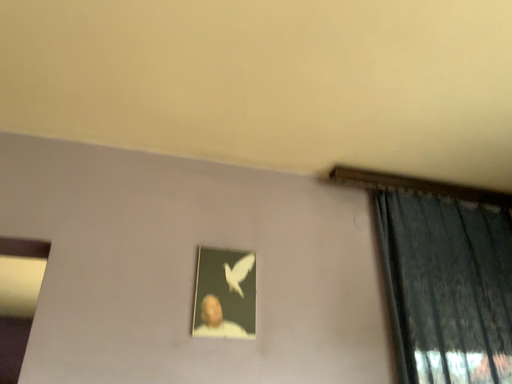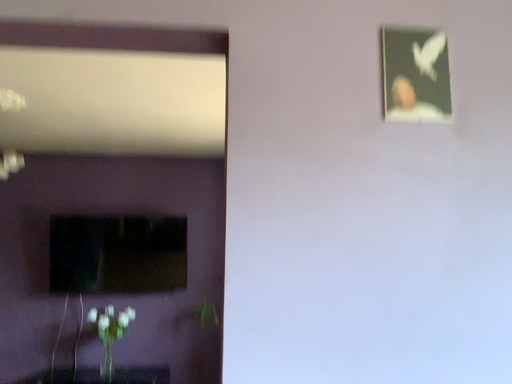
Question: How did the camera likely rotate when shooting the video?

Choices:
 (A) rotated downward
 (B) rotated upward

Answer: (A)